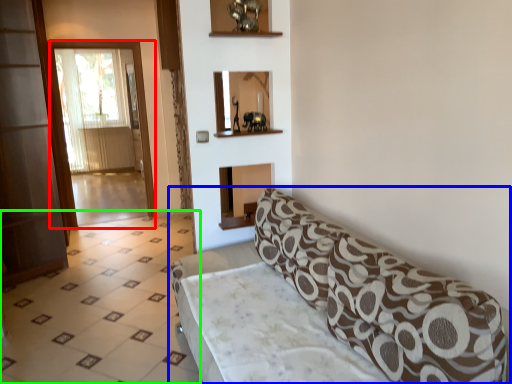
Question: Which is farther away from screen door (highlighted by a red box)? studio couch (highlighted by a blue box) or tile (highlighted by a green box)?

Choices:
 (A) studio couch
 (B) tile

Answer: (A)